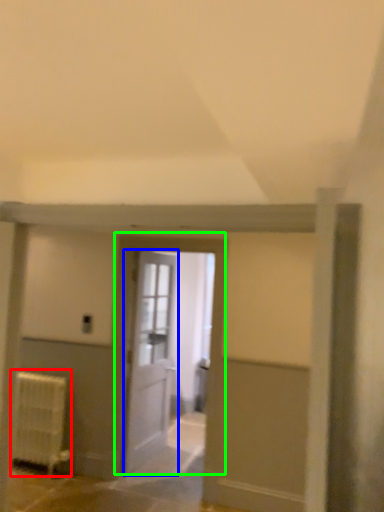
Question: Which is nearer to the radiator (highlighted by a red box)? door (highlighted by a blue box) or door (highlighted by a green box).

Choices:
 (A) door
 (B) door

Answer: (A)